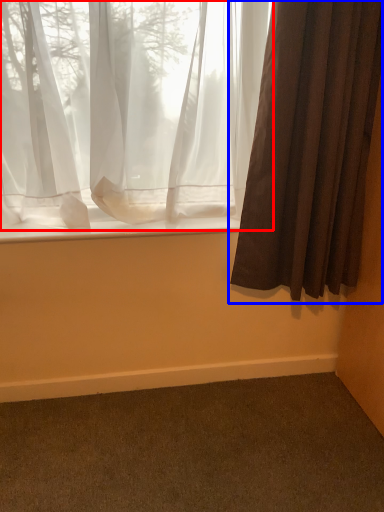
Question: Among these objects, which one is nearest to the camera, curtain (highlighted by a red box) or curtain (highlighted by a blue box)?

Choices:
 (A) curtain
 (B) curtain

Answer: (B)